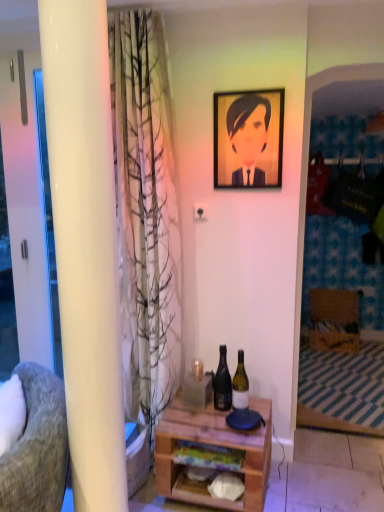
This screenshot has width=384, height=512. I want to click on free location to the left of green glass bottle at center, the 2th bottle when ordered from left to right, so click(x=200, y=418).